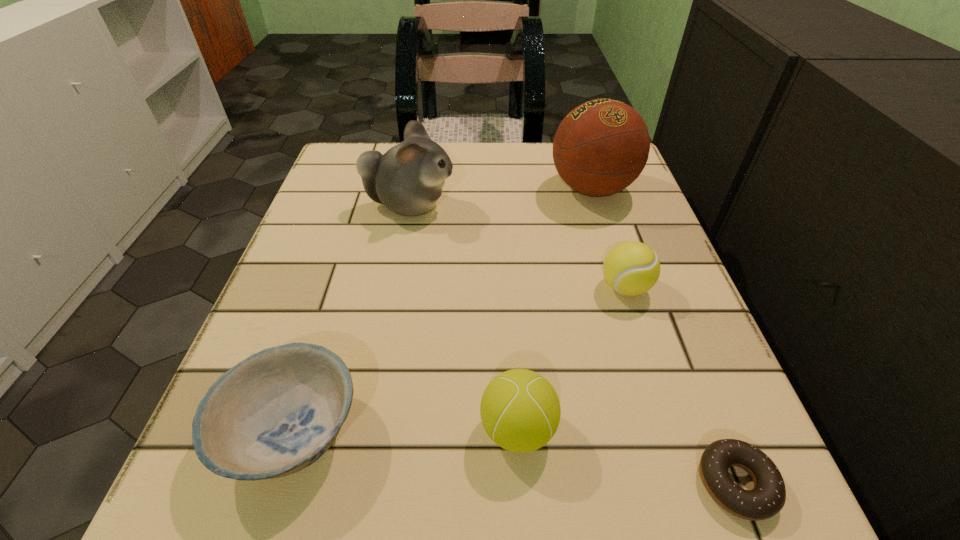
Locate an element on the screen. The width and height of the screenshot is (960, 540). basketball is located at coordinates (601, 147).

This screenshot has height=540, width=960. Find the location of `hamster`. hamster is located at coordinates (x=408, y=179).

Locate an element on the screen. the left tennis ball is located at coordinates (520, 411).

This screenshot has height=540, width=960. I want to click on the nearer tennis ball, so 520,411.

Locate an element on the screen. This screenshot has height=540, width=960. the third farthest object is located at coordinates (631, 268).

Identify the location of the right tennis ball. (631, 268).

You are a GUI agent. You are given a task and a screenshot of the screen. Output one action in this format:
    pyautogui.click(x=<x>, y=<y>)
    Task: Click on the bowl
    Image resolution: width=960 pixels, height=540 pixels.
    Given the screenshot: What is the action you would take?
    pyautogui.click(x=275, y=413)

The image size is (960, 540). Identify the location of the shortest object. (767, 498).

Locate an element on the screen. The height and width of the screenshot is (540, 960). vacant space located on the front of the basketball is located at coordinates (645, 356).

Identify the location of free space located 0.180m on the face of the second tallest object. (542, 206).